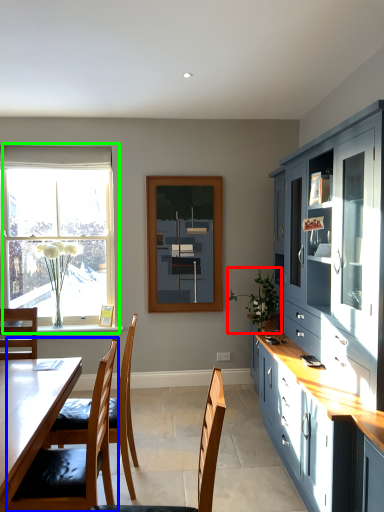
Question: Considering the real-world distances, which object is closest to plant (highlighted by a red box)? chair (highlighted by a blue box) or window (highlighted by a green box).

Choices:
 (A) chair
 (B) window

Answer: (A)